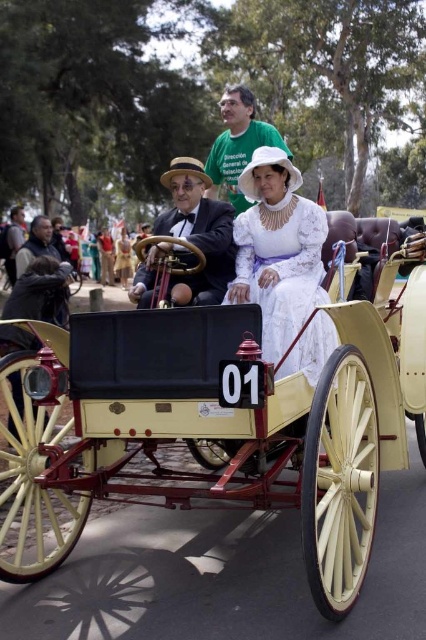
Is light cream polished wood horse cart at center taller than dark brown leather jacket at left?

Yes, light cream polished wood horse cart at center is taller than dark brown leather jacket at left.

Between light cream polished wood horse cart at center and dark brown leather jacket at left, which one is positioned higher?

Positioned higher is dark brown leather jacket at left.

Find the location of a particular element. The image size is (426, 640). light cream polished wood horse cart at center is located at coordinates (213, 426).

Which is in front, point (78, 374) or point (147, 276)?

Positioned in front is point (78, 374).

Who is more distant from viewer, (199, 396) or (226, 220)?

The point (226, 220) is behind.

At what (x,y) coordinates should I click in order to perform the action: click on light cream polished wood horse cart at center. Please return your answer as a coordinate pair (x, y). The image size is (426, 640). Looking at the image, I should click on (213, 426).

Can you confirm if white cotton dress at center is shorter than dark brown leather jacket at left?

No.

Between point (212, 150) and point (32, 250), which one is positioned behind?

Positioned behind is point (32, 250).

Image resolution: width=426 pixels, height=640 pixels. In order to click on white cotton dress at center in this screenshot , I will do `click(238, 145)`.